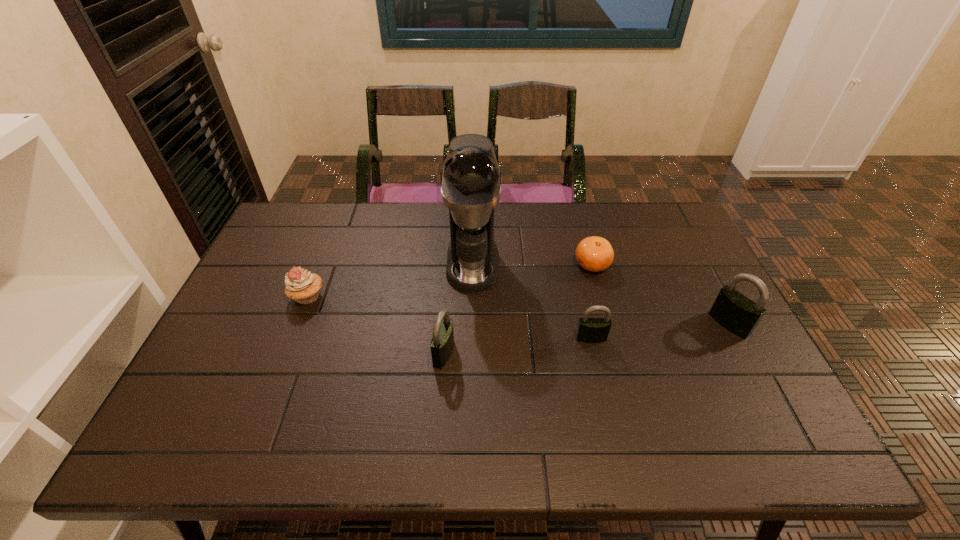
The image size is (960, 540). I want to click on vacant space at the near left corner, so click(192, 405).

Identify the location of vacant area at the far right corner. The height and width of the screenshot is (540, 960). (635, 205).

In order to click on vacant space that is in between the rightmost padlock and the second padlock from right to left in this screenshot , I will do `click(660, 331)`.

Image resolution: width=960 pixels, height=540 pixels. I want to click on empty space that is in between the clementine and the tallest object, so click(x=532, y=264).

Where is `empty location between the leftmost object and the rightmost object`? This screenshot has width=960, height=540. empty location between the leftmost object and the rightmost object is located at coordinates point(518,310).

Locate an element on the screen. The width and height of the screenshot is (960, 540). vacant space that is in between the second tallest padlock and the shortest object is located at coordinates (517, 309).

Identify the location of unoccupied position between the rightmost padlock and the coffee maker. (601, 293).

The width and height of the screenshot is (960, 540). In order to click on unoccupied area between the tallest object and the rightmost padlock in this screenshot , I will do `click(601, 293)`.

Identify which object is the third closest to the rightmost padlock. Please provide its 2D coordinates. Your answer should be formatted as a tuple, i.e. [(x, y)], where the tuple contains the x and y coordinates of a point satisfying the conditions above.

[(470, 176)]

Identify the location of object identified as the fourth closest to the shortest object. (442, 343).